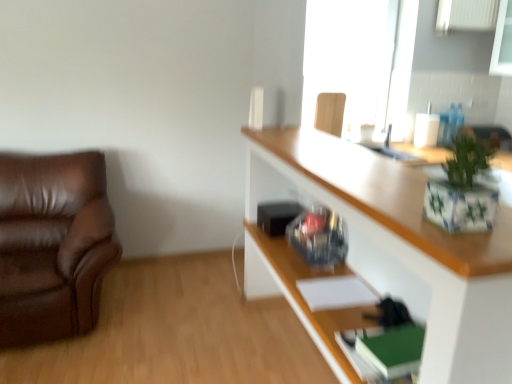
At what (x,y) coordinates should I click in order to perform the action: click on brown leather couch at left, the 1th chair when ordered from bottom to top. Please return your answer as a coordinate pair (x, y). This screenshot has height=384, width=512. Looking at the image, I should click on (53, 245).

Locate an element on the screen. white glossy cabinet at upper right is located at coordinates (401, 246).

The image size is (512, 384). I want to click on wooden chair at upper right, the first chair viewed from the back, so click(x=330, y=112).

This screenshot has width=512, height=384. Describe the element at coordinates (330, 112) in the screenshot. I see `wooden chair at upper right, the 1th chair positioned from the right` at that location.

At what (x,y) coordinates should I click in order to perform the action: click on green ceramic pot at upper right. Please return your answer as a coordinate pair (x, y). This screenshot has width=512, height=384. Looking at the image, I should click on (463, 189).

Image resolution: width=512 pixels, height=384 pixels. Find the location of `brown leather couch at left, which is the 2th chair from top to bottom`. brown leather couch at left, which is the 2th chair from top to bottom is located at coordinates (53, 245).

Is brown leather couch at left, which is the 2th chair from top to bottom, beside wooden chair at upper right, the first chair viewed from the back?

No, brown leather couch at left, which is the 2th chair from top to bottom, is not making contact with wooden chair at upper right, the first chair viewed from the back.

From the image's perspective, between brown leather couch at left, the 1th chair when ordered from bottom to top, and wooden chair at upper right, which ranks as the 1th chair in top-to-bottom order, who is located below?

brown leather couch at left, the 1th chair when ordered from bottom to top, from the image's perspective.

Identify the location of chair on the right of the brown leather couch at left, the second chair when ordered from right to left. (330, 112).

Is brown leather couch at left, the second chair when ordered from right to left, thinner than wooden chair at upper right, which is the second chair in left-to-right order?

In fact, brown leather couch at left, the second chair when ordered from right to left, might be wider than wooden chair at upper right, which is the second chair in left-to-right order.

Can you tell me how much white glossy cabinet at upper right and brown leather couch at left, arranged as the first chair when viewed from the front, differ in facing direction?

The facing directions of white glossy cabinet at upper right and brown leather couch at left, arranged as the first chair when viewed from the front, are 92 degrees apart.

From a real-world perspective, does white glossy cabinet at upper right stand above brown leather couch at left, which is the 2th chair from top to bottom?

Yes, from a real-world perspective, white glossy cabinet at upper right is above brown leather couch at left, which is the 2th chair from top to bottom.

Is point (326, 185) more distant than point (49, 237)?

No, it is in front of (49, 237).

Which of these two, white glossy cabinet at upper right or transparent glass window at upper center, stands taller?

Standing taller between the two is white glossy cabinet at upper right.

I want to click on window positioned vertically above the white glossy cabinet at upper right (from a real-world perspective), so click(x=360, y=61).

Is white glossy cabinet at upper right far from transparent glass window at upper center?

Yes, white glossy cabinet at upper right and transparent glass window at upper center are located far from each other.

Is point (257, 191) closer or farther from the camera than point (398, 39)?

Point (257, 191) is closer to the camera than point (398, 39).

From a real-world perspective, who is located lower, transparent glass window at upper center or wooden chair at upper right, which ranks as the 2th chair in front-to-back order?

wooden chair at upper right, which ranks as the 2th chair in front-to-back order.

Can you confirm if transparent glass window at upper center is bigger than wooden chair at upper right, which ranks as the 2th chair in front-to-back order?

Yes.

What's the angular difference between transparent glass window at upper center and wooden chair at upper right, which ranks as the 1th chair in top-to-bottom order,'s facing directions?

The angle between the facing direction of transparent glass window at upper center and the facing direction of wooden chair at upper right, which ranks as the 1th chair in top-to-bottom order, is 2.4 degrees.

Considering the sizes of objects transparent glass window at upper center and wooden chair at upper right, which ranks as the 2th chair in front-to-back order, in the image provided, who is thinner, transparent glass window at upper center or wooden chair at upper right, which ranks as the 2th chair in front-to-back order,?

wooden chair at upper right, which ranks as the 2th chair in front-to-back order.

Starting from the transparent glass window at upper center, which chair is the 2nd one in front? Please provide its 2D coordinates.

[(53, 245)]

Considering the relative positions of brown leather couch at left, the second chair when ordered from right to left, and transparent glass window at upper center in the image provided, is brown leather couch at left, the second chair when ordered from right to left, to the right of transparent glass window at upper center from the viewer's perspective?

No.

Is brown leather couch at left, which is the 2th chair from top to bottom, bigger than transparent glass window at upper center?

Correct, brown leather couch at left, which is the 2th chair from top to bottom, is larger in size than transparent glass window at upper center.

Considering the points (33, 201) and (412, 28), which point is in front, point (33, 201) or point (412, 28)?

Point (33, 201)

Which point is more distant from viewer, (428,240) or (452,144)?

The point (452,144) is more distant.

Is white glossy cabinet at upper right surrounding green ceramic pot at upper right?

That's incorrect, green ceramic pot at upper right is not inside white glossy cabinet at upper right.

Who is taller, white glossy cabinet at upper right or green ceramic pot at upper right?

white glossy cabinet at upper right is taller.

You are a GUI agent. You are given a task and a screenshot of the screen. Output one action in this format:
    pyautogui.click(x=<x>, y=<y>)
    Task: Click on the houseplant that is on the right side of white glossy cabinet at upper right
    Image resolution: width=512 pixels, height=384 pixels.
    Given the screenshot: What is the action you would take?
    pyautogui.click(x=463, y=189)

Is transparent glass window at upper center inside or outside of brown leather couch at left, arranged as the first chair when viewed from the front?

The correct answer is: outside.

Is the surface of transparent glass window at upper center in direct contact with brown leather couch at left, arranged as the first chair when viewed from the front?

No, transparent glass window at upper center is not beside brown leather couch at left, arranged as the first chair when viewed from the front.

Based on the photo, from a real-world perspective, is transparent glass window at upper center positioned over brown leather couch at left, arranged as the first chair when viewed from the front, based on gravity?

Correct, in the physical world, transparent glass window at upper center is higher than brown leather couch at left, arranged as the first chair when viewed from the front.

Identify the location of chair that appears on the right of brown leather couch at left, arranged as the first chair when viewed from the front. (330, 112).

The image size is (512, 384). What are the coordinates of `cabinetry above the brown leather couch at left, arranged as the first chair when viewed from the front (from a real-world perspective)` in the screenshot? It's located at (401, 246).

Which object lies further to the anchor point white glossy cabinet at upper right, transparent glass window at upper center or brown leather couch at left, arranged as the second chair when viewed from the back?

transparent glass window at upper center is further to white glossy cabinet at upper right.

Looking at this image, considering their positions, is brown leather couch at left, which is the 2th chair from top to bottom, positioned further to transparent glass window at upper center than green ceramic pot at upper right?

Among the two, green ceramic pot at upper right is located further to transparent glass window at upper center.

Looking at the image, which one is located further to wooden chair at upper right, which ranks as the 2th chair in bottom-to-top order, brown leather couch at left, arranged as the second chair when viewed from the back, or white glossy cabinet at upper right?

brown leather couch at left, arranged as the second chair when viewed from the back, lies further to wooden chair at upper right, which ranks as the 2th chair in bottom-to-top order, than the other object.

Considering their positions, is transparent glass window at upper center positioned closer to green ceramic pot at upper right than brown leather couch at left, the 1th chair when ordered from bottom to top?

brown leather couch at left, the 1th chair when ordered from bottom to top.

From the image, which object appears to be nearer to brown leather couch at left, which is the 2th chair from top to bottom, wooden chair at upper right, the first chair viewed from the back, or green ceramic pot at upper right?

Among the two, wooden chair at upper right, the first chair viewed from the back, is located nearer to brown leather couch at left, which is the 2th chair from top to bottom.

Looking at this image, looking at the image, which one is located further to white glossy cabinet at upper right, brown leather couch at left, arranged as the second chair when viewed from the back, or green ceramic pot at upper right?

brown leather couch at left, arranged as the second chair when viewed from the back, is positioned further to the anchor white glossy cabinet at upper right.

Which object lies further to the anchor point green ceramic pot at upper right, brown leather couch at left, arranged as the second chair when viewed from the back, or wooden chair at upper right, which ranks as the 2th chair in front-to-back order?

brown leather couch at left, arranged as the second chair when viewed from the back, lies further to green ceramic pot at upper right than the other object.

Which object lies nearer to the anchor point transparent glass window at upper center, wooden chair at upper right, which is the second chair in left-to-right order, or white glossy cabinet at upper right?

wooden chair at upper right, which is the second chair in left-to-right order, lies closer to transparent glass window at upper center than the other object.

Identify the location of houseplant located between white glossy cabinet at upper right and transparent glass window at upper center in the depth direction. The image size is (512, 384). pos(463,189).

At what (x,y) coordinates should I click in order to perform the action: click on houseplant located between white glossy cabinet at upper right and wooden chair at upper right, the first chair viewed from the back, in the depth direction. Please return your answer as a coordinate pair (x, y). This screenshot has height=384, width=512. Looking at the image, I should click on (463, 189).

Locate an element on the screen. This screenshot has height=384, width=512. cabinetry between brown leather couch at left, arranged as the second chair when viewed from the back, and green ceramic pot at upper right from left to right is located at coordinates (401, 246).

Identify the location of chair between white glossy cabinet at upper right and wooden chair at upper right, which ranks as the 1th chair in top-to-bottom order, from front to back. (53, 245).